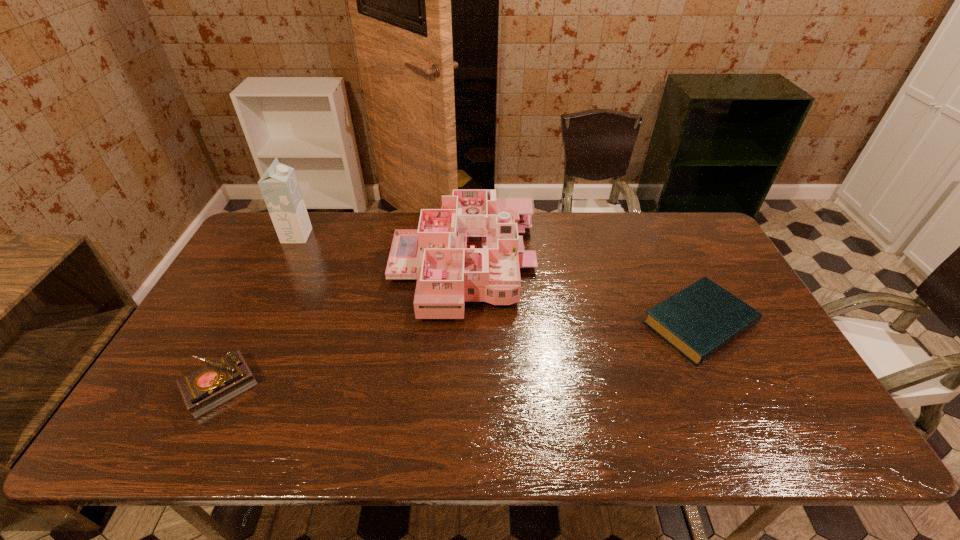
Identify the location of carton positioned at the far edge. Image resolution: width=960 pixels, height=540 pixels. (279, 186).

The image size is (960, 540). I want to click on dollhouse positioned at the far edge, so click(x=469, y=251).

Find the location of a particular element. This screenshot has width=960, height=540. object located at the near edge is located at coordinates (218, 382).

This screenshot has width=960, height=540. Identify the location of carton that is positioned at the left edge. (279, 186).

Find the location of a particular element. diary present at the left edge is located at coordinates (218, 382).

Locate an element on the screen. object at the right edge is located at coordinates (701, 319).

Identify the location of object present at the far left corner. The image size is (960, 540). (279, 186).

Locate an element on the screen. Image resolution: width=960 pixels, height=540 pixels. object located in the near left corner section of the desktop is located at coordinates (218, 382).

The height and width of the screenshot is (540, 960). What are the coordinates of `vacant point at the far edge` in the screenshot? It's located at pos(564,218).

Find the location of a particular element. free spot at the near edge of the desktop is located at coordinates (365, 426).